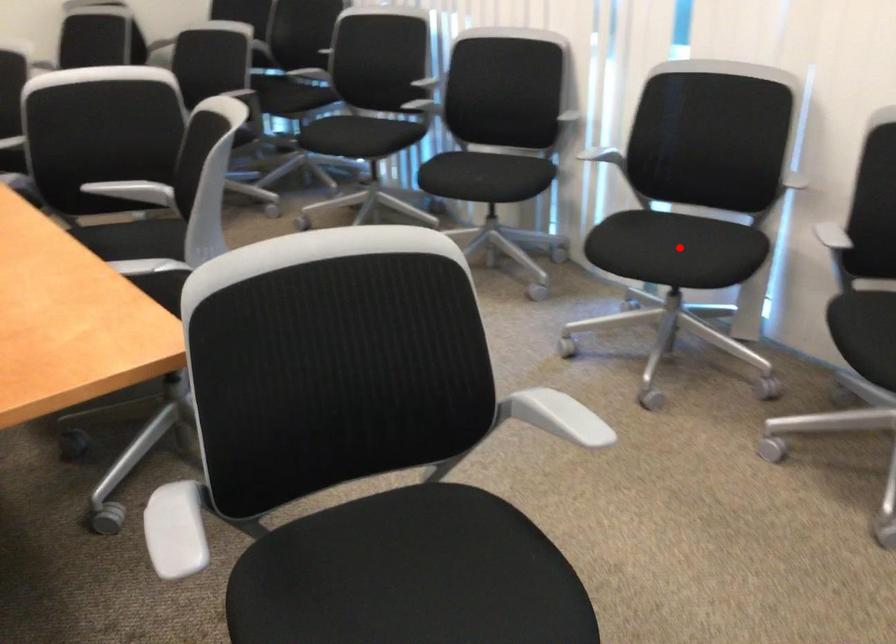
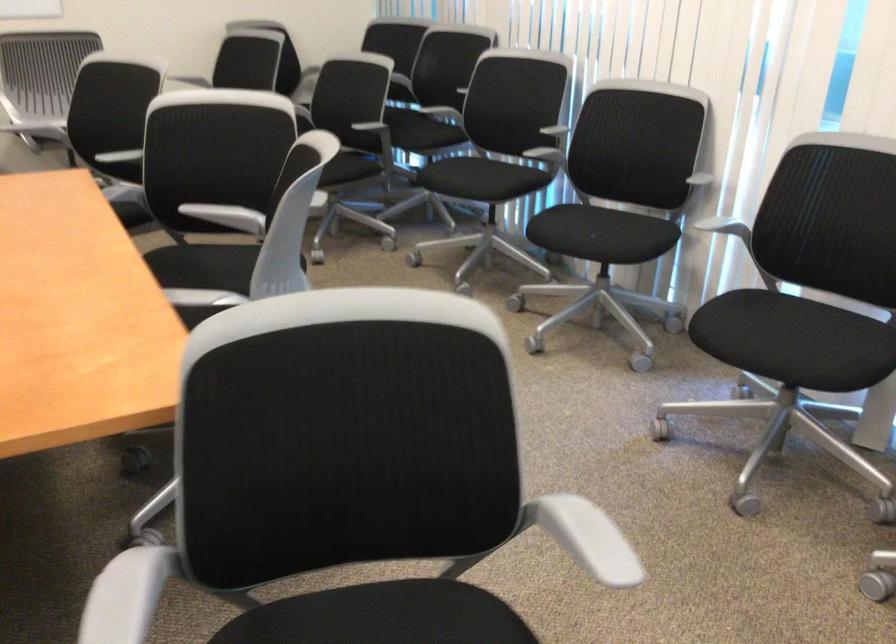
The point at the highlighted location is marked in the first image. Where is the corresponding point in the second image?

(795, 342)